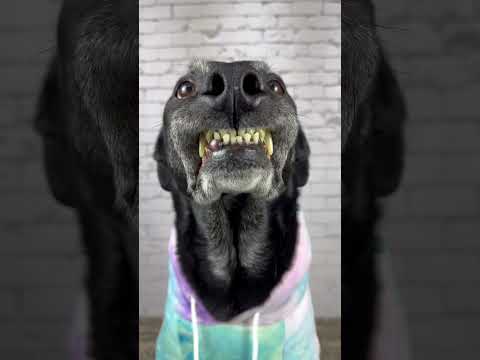
Where is `white brick wall`? white brick wall is located at coordinates (327, 13), (151, 304), (328, 305), (157, 7).